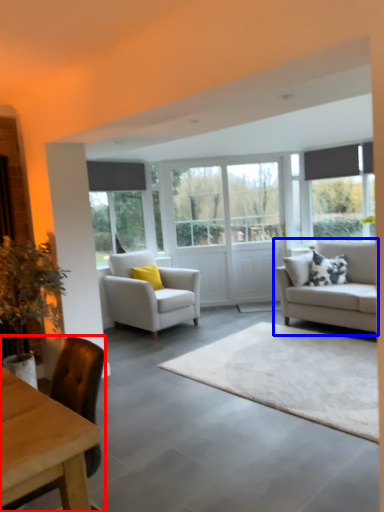
Question: Which point is further to the camera, chair (highlighted by a red box) or studio couch (highlighted by a blue box)?

Choices:
 (A) chair
 (B) studio couch

Answer: (B)